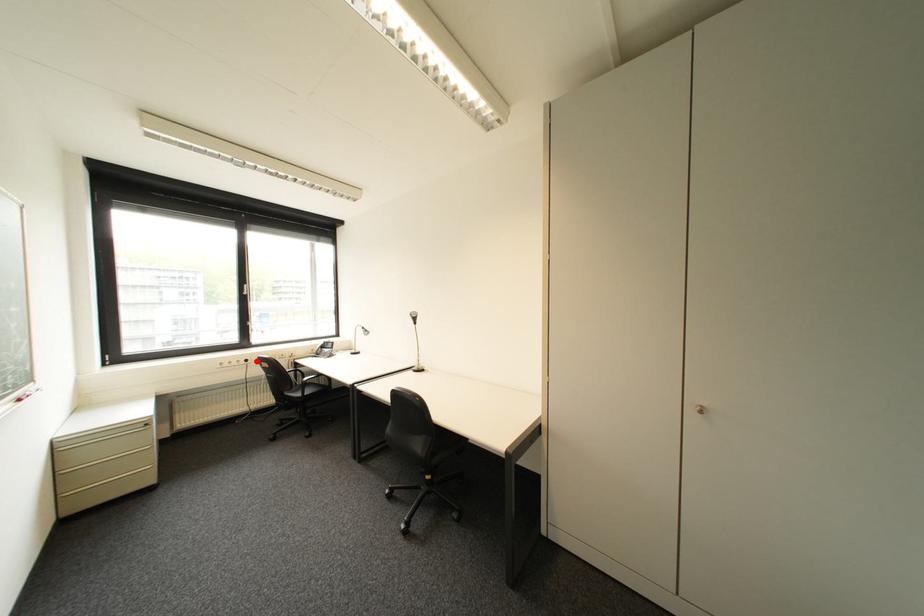
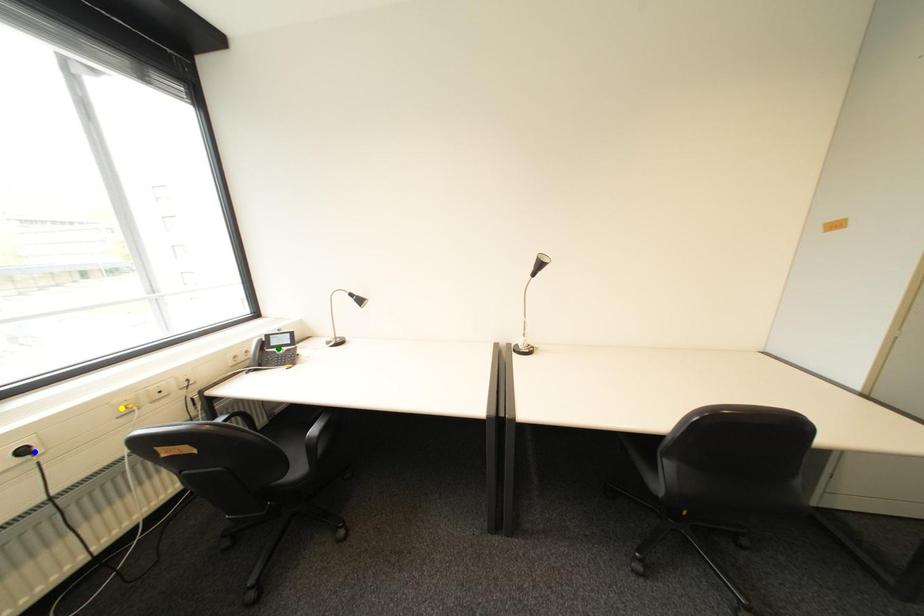
Question: I am providing you with two images of the same scene from different viewpoints. A red point is marked on the first image. You are given multiple points on the second image. In image 2, which mark is for the same physical point as the one in image 1?

Choices:
 (A) blue point
 (B) yellow point
 (C) green point

Answer: (A)